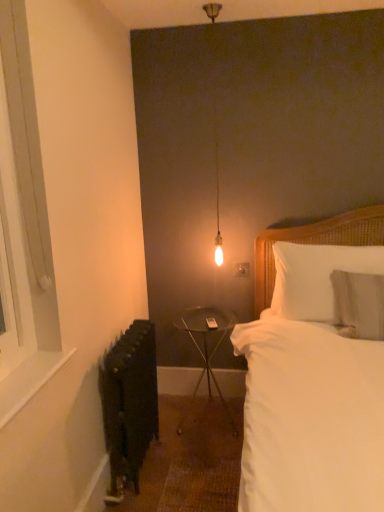
Measure the distance between point (189, 335) and camera.

Point (189, 335) and camera are 8.36 feet apart from each other.

What do you see at coordinates (28, 381) in the screenshot? The height and width of the screenshot is (512, 384). I see `white wood at lower left` at bounding box center [28, 381].

Measure the distance between point (27, 388) and camera.

A distance of 4.04 feet exists between point (27, 388) and camera.

What do you see at coordinates (23, 229) in the screenshot? The image size is (384, 512). I see `white wood window at left` at bounding box center [23, 229].

Consider the image. Measure the distance between point (56, 347) and camera.

Point (56, 347) and camera are 4.87 feet apart.

How much space does white soft pillow at upper right, arranged as the second pillow when viewed from the back, occupy vertically?

It is 17.07 inches.

What are the coordinates of `white cotton bed at center` in the screenshot? It's located at (310, 418).

Identify the location of metallic silver table at center. (206, 340).

From the image's perspective, which is above, white wood window at left or white cotton bed at center?

white wood window at left.

Is white cotton bed at center at the back of white wood window at left?

No, white wood window at left is not facing away from white cotton bed at center.

Which object is closer to the camera, white wood window at left or white cotton bed at center?

Positioned in front is white cotton bed at center.

From a real-world perspective, which object rests below the other?

From a 3D spatial view, metallic silver table at center is below.

From the image's perspective, between metallic silver table at center and white soft pillow at upper right, the 1th pillow when ordered from back to front, who is located below?

From the image's view, metallic silver table at center is below.

Between metallic silver table at center and white soft pillow at upper right, the 1th pillow when ordered from back to front, which one appears on the left side from the viewer's perspective?

metallic silver table at center.

Based on their sizes in the image, would you say metallic silver table at center is bigger or smaller than white soft pillow at upper right, arranged as the 2th pillow when viewed from the front?

Considering their sizes, metallic silver table at center takes up more space than white soft pillow at upper right, arranged as the 2th pillow when viewed from the front.

Considering the points (309, 277) and (195, 389), which point is in front, point (309, 277) or point (195, 389)?

Positioned in front is point (309, 277).

Consider the image. Measure the distance between white soft pillow at upper right, arranged as the 2th pillow when viewed from the front, and metallic silver table at center.

The distance of white soft pillow at upper right, arranged as the 2th pillow when viewed from the front, from metallic silver table at center is 26.78 inches.

Between white soft pillow at upper right, the 1th pillow when ordered from back to front, and metallic silver table at center, which one is positioned behind?

metallic silver table at center is further from the camera.

From the image's perspective, is white soft pillow at upper right, the 1th pillow when ordered from back to front, located above or below metallic silver table at center?

Based on their image positions, white soft pillow at upper right, the 1th pillow when ordered from back to front, is located above metallic silver table at center.

Choose the correct answer: Is white wood window at left inside white wood at lower left or outside it?

white wood window at left is not inside white wood at lower left, it's outside.

Is white wood window at left not near white wood at lower left?

No, there isn't a large distance between white wood window at left and white wood at lower left.

Between white wood window at left and white wood at lower left, which one has larger size?

With larger size is white wood window at left.

Does white wood window at left turn towards white wood at lower left?

No.

Is white cotton bed at center further to the viewer compared to white soft pillow at upper right, the first pillow in the front-to-back sequence?

That is False.

Looking at their sizes, would you say white cotton bed at center is wider or thinner than white soft pillow at upper right, the first pillow in the front-to-back sequence?

Clearly, white cotton bed at center has more width compared to white soft pillow at upper right, the first pillow in the front-to-back sequence.

Considering the sizes of white cotton bed at center and white soft pillow at upper right, the first pillow in the front-to-back sequence, in the image, is white cotton bed at center bigger or smaller than white soft pillow at upper right, the first pillow in the front-to-back sequence,?

Considering their sizes, white cotton bed at center takes up more space than white soft pillow at upper right, the first pillow in the front-to-back sequence.

From a real-world perspective, is white cotton bed at center beneath white soft pillow at upper right, arranged as the second pillow when viewed from the back?

Yes, from a real-world perspective, white cotton bed at center is under white soft pillow at upper right, arranged as the second pillow when viewed from the back.

Do you think white wood at lower left is within white soft pillow at upper right, arranged as the 2th pillow when viewed from the front, or outside of it?

white wood at lower left lies outside white soft pillow at upper right, arranged as the 2th pillow when viewed from the front.

Consider the image. Which object is closer to the camera, white wood at lower left or white soft pillow at upper right, the 1th pillow when ordered from back to front?

white wood at lower left is closer to the camera.

From the image's perspective, is white wood at lower left on top of white soft pillow at upper right, arranged as the 2th pillow when viewed from the front?

No, from the image's perspective, white wood at lower left is not on top of white soft pillow at upper right, arranged as the 2th pillow when viewed from the front.

Looking at the image, does metallic silver table at center seem bigger or smaller compared to white wood at lower left?

Clearly, metallic silver table at center is larger in size than white wood at lower left.

Does point (205, 341) appear closer or farther from the camera than point (54, 372)?

Point (205, 341) appears to be farther away from the viewer than point (54, 372).

Can you tell me how much metallic silver table at center and white wood at lower left differ in facing direction?

The angle between the facing direction of metallic silver table at center and the facing direction of white wood at lower left is 90.8 degrees.

Is metallic silver table at center facing away from white wood at lower left?

No, metallic silver table at center is not facing the opposite direction of white wood at lower left.

At what (x,y) coordinates should I click in order to perform the action: click on bed in front of the white wood window at left. Please return your answer as a coordinate pair (x, y). This screenshot has height=512, width=384. Looking at the image, I should click on (310, 418).

There is a metallic silver table at center. In order to click on the 2nd pillow above it (from a real-world perspective) in this screenshot , I will do `click(316, 277)`.

Consider the image. Looking at the image, which one is located further to black matte radiator at lower left, white cotton bed at center or metallic silver table at center?

white cotton bed at center is positioned further to the anchor black matte radiator at lower left.

Which object lies nearer to the anchor point white wood at lower left, metallic silver table at center or white soft pillow at upper right, the 1th pillow when ordered from back to front?

Among the two, white soft pillow at upper right, the 1th pillow when ordered from back to front, is located nearer to white wood at lower left.

From the image, which object appears to be farther from white wood window at left, white wood at lower left or white soft pillow at upper right, the 1th pillow when ordered from back to front?

white soft pillow at upper right, the 1th pillow when ordered from back to front, lies further to white wood window at left than the other object.

Which object lies further to the anchor point metallic silver table at center, white soft pillow at upper right, arranged as the 2th pillow when viewed from the front, or white wood at lower left?

white wood at lower left.

Looking at the image, which one is located closer to white wood window at left, black matte radiator at lower left or white wood at lower left?

The object closer to white wood window at left is white wood at lower left.

Considering their positions, is white cotton bed at center positioned further to black matte radiator at lower left than white soft pillow at upper right, the first pillow in the front-to-back sequence?

Among the two, white soft pillow at upper right, the first pillow in the front-to-back sequence, is located further to black matte radiator at lower left.

Estimate the real-world distances between objects in this image. Which object is further from white cotton bed at center, white wood at lower left or metallic silver table at center?

metallic silver table at center is positioned further to the anchor white cotton bed at center.

From the image, which object appears to be farther from white soft pillow at upper right, arranged as the second pillow when viewed from the back, black matte radiator at lower left or metallic silver table at center?

black matte radiator at lower left lies further to white soft pillow at upper right, arranged as the second pillow when viewed from the back, than the other object.

At what (x,y) coordinates should I click in order to perform the action: click on table situated between black matte radiator at lower left and white soft pillow at upper right, arranged as the 2th pillow when viewed from the front, from left to right. Please return your answer as a coordinate pair (x, y). Image resolution: width=384 pixels, height=512 pixels. Looking at the image, I should click on (206, 340).

Locate an element on the screen. pillow between white wood at lower left and white soft pillow at upper right, the first pillow in the front-to-back sequence, from left to right is located at coordinates (316, 277).

This screenshot has width=384, height=512. What are the coordinates of `table between white wood at lower left and white soft pillow at upper right, arranged as the 2th pillow when viewed from the front, in the horizontal direction` in the screenshot? It's located at (206, 340).

At what (x,y) coordinates should I click in order to perform the action: click on radiator located between white wood at lower left and white soft pillow at upper right, the 1th pillow when ordered from back to front, in the left-right direction. Please return your answer as a coordinate pair (x, y). The height and width of the screenshot is (512, 384). Looking at the image, I should click on (129, 403).